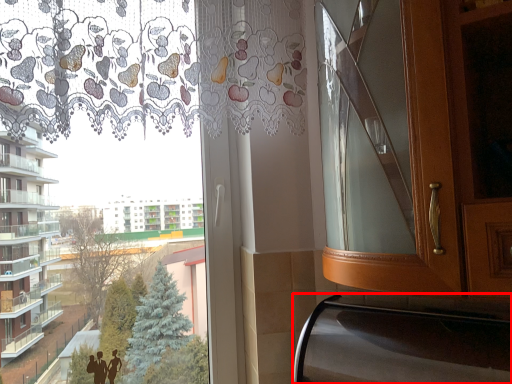
Question: Observing the image, what is the correct spatial positioning of oven (annotated by the red box) in reference to bay window?

Choices:
 (A) right
 (B) left

Answer: (A)